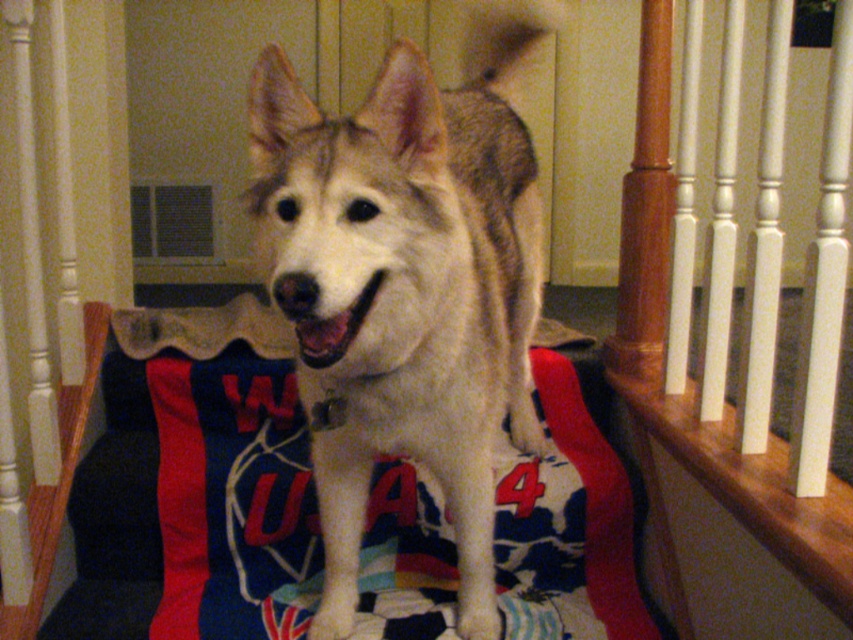
Between white fur dog at center and white wood railing at upper center, which one appears on the right side from the viewer's perspective?

From the viewer's perspective, white wood railing at upper center appears more on the right side.

Which is in front, point (370, 120) or point (757, 216)?

Point (370, 120)

Measure the distance between white fur dog at center and camera.

A distance of 37.13 inches exists between white fur dog at center and camera.

Locate an element on the screen. The image size is (853, 640). white fur dog at center is located at coordinates (405, 284).

Is white fur dog at center to the left of red and blue striped fabric at center from the viewer's perspective?

No, white fur dog at center is not to the left of red and blue striped fabric at center.

Is point (339, 262) closer to camera compared to point (184, 468)?

Yes.

Image resolution: width=853 pixels, height=640 pixels. Identify the location of white fur dog at center. (x=405, y=284).

What do you see at coordinates (193, 504) in the screenshot? The height and width of the screenshot is (640, 853). I see `red and blue striped fabric at center` at bounding box center [193, 504].

Between point (579, 464) and point (735, 492), which one is positioned behind?

Point (579, 464)

The height and width of the screenshot is (640, 853). I want to click on red and blue striped fabric at center, so click(193, 504).